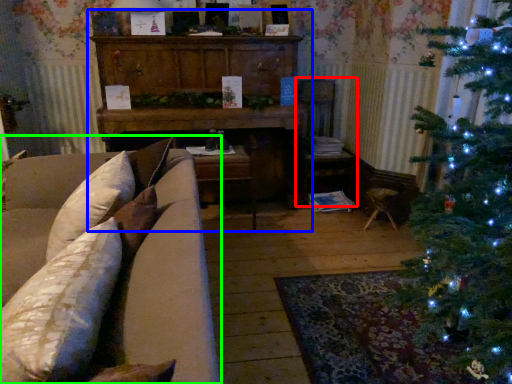
Question: Considering the real-world distances, which object is closest to armchair (highlighted by a red box)? dresser (highlighted by a blue box) or studio couch (highlighted by a green box).

Choices:
 (A) dresser
 (B) studio couch

Answer: (A)